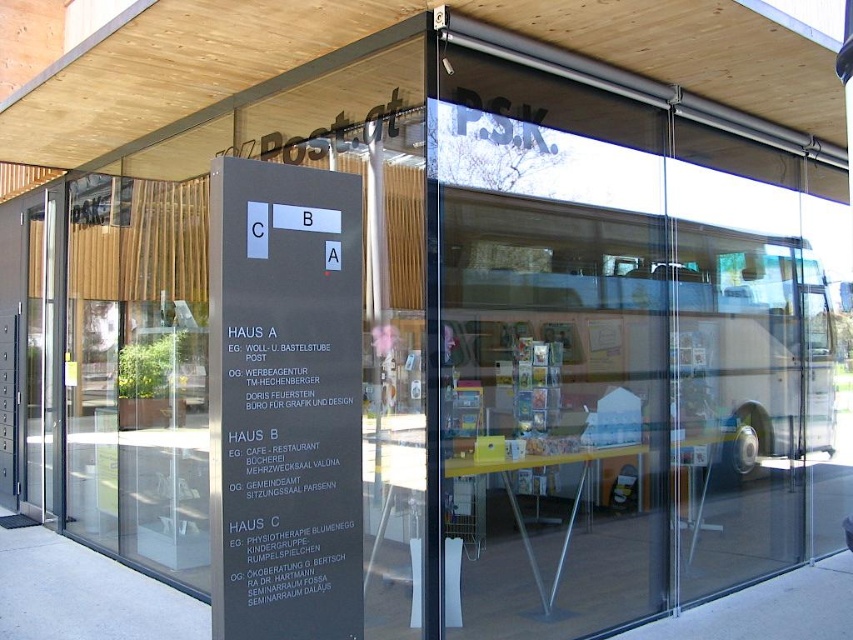
Question: Can you confirm if metallic silver bus at center is thinner than transparent glass door at left?

Choices:
 (A) no
 (B) yes

Answer: (A)

Question: Considering the real-world distances, which object is closest to the metallic silver bus at center?

Choices:
 (A) black matte sign at center
 (B) transparent glass door at left

Answer: (A)

Question: Can you confirm if metallic silver bus at center is positioned to the left of black matte sign at center?

Choices:
 (A) no
 (B) yes

Answer: (A)

Question: In this image, where is transparent glass door at left located relative to black matte sign at center?

Choices:
 (A) left
 (B) right

Answer: (A)

Question: Which point is farther to the camera?

Choices:
 (A) (172, 436)
 (B) (469, 333)

Answer: (A)

Question: Which point is closer to the camera?

Choices:
 (A) metallic silver bus at center
 (B) black matte sign at center

Answer: (B)